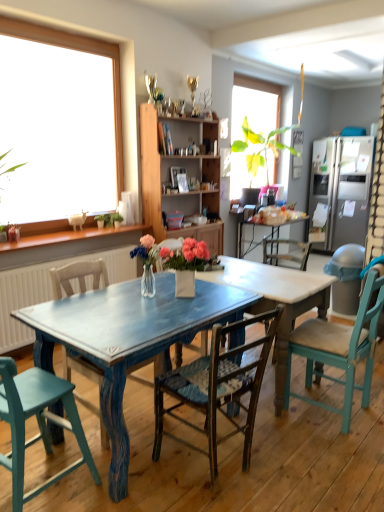
Question: Considering their positions, is wooden cabinet at center located in front of or behind teal painted wood chair at lower left, the first chair from the left?

Choices:
 (A) behind
 (B) front

Answer: (A)

Question: Looking at their shapes, would you say wooden cabinet at center is wider or thinner than teal painted wood chair at lower left, which appears as the 4th chair when viewed from the right?

Choices:
 (A) wide
 (B) thin

Answer: (B)

Question: Which object is the farthest from the satin silver refrigerator at right?

Choices:
 (A) wooden woven seat chair at center, the third chair viewed from the left
 (B) distressed blue table at center
 (C) blue distressed wood table at center
 (D) wooden chair at left, the second chair when ordered from left to right
 (E) teal painted wood chair at lower left, the first chair from the left

Answer: (E)

Question: Which object is positioned farthest from the teal painted wood chair at lower left, the first chair from the left?

Choices:
 (A) satin silver refrigerator at right
 (B) teal wood chair at right, which is the fourth chair in left-to-right order
 (C) wooden woven seat chair at center, the third chair viewed from the left
 (D) wooden chair at left, the second chair when ordered from left to right
 (E) wooden cabinet at center

Answer: (A)